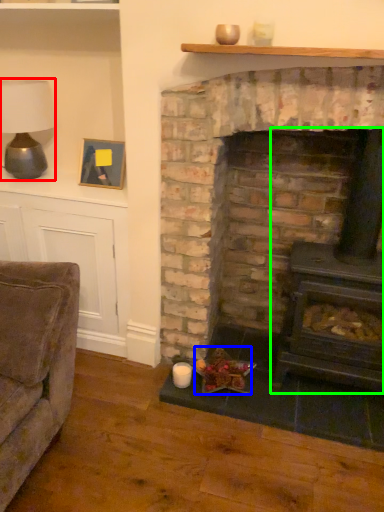
Question: Estimate the real-world distances between objects in this image. Which object is farther from table lamp (highlighted by a red box), food (highlighted by a blue box) or wood burning stove (highlighted by a green box)?

Choices:
 (A) food
 (B) wood burning stove

Answer: (B)